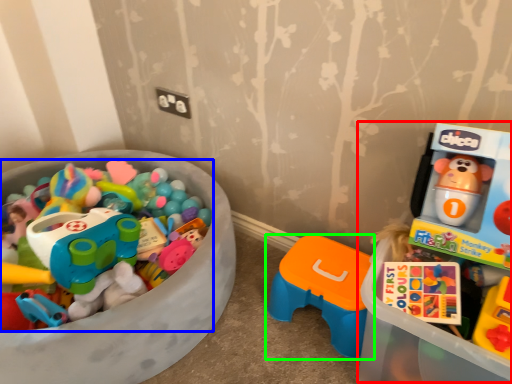
Question: Which object is the farthest from toyshop (highlighted by a red box)? Choose among these: toy (highlighted by a blue box) or toy (highlighted by a green box).

Choices:
 (A) toy
 (B) toy

Answer: (A)